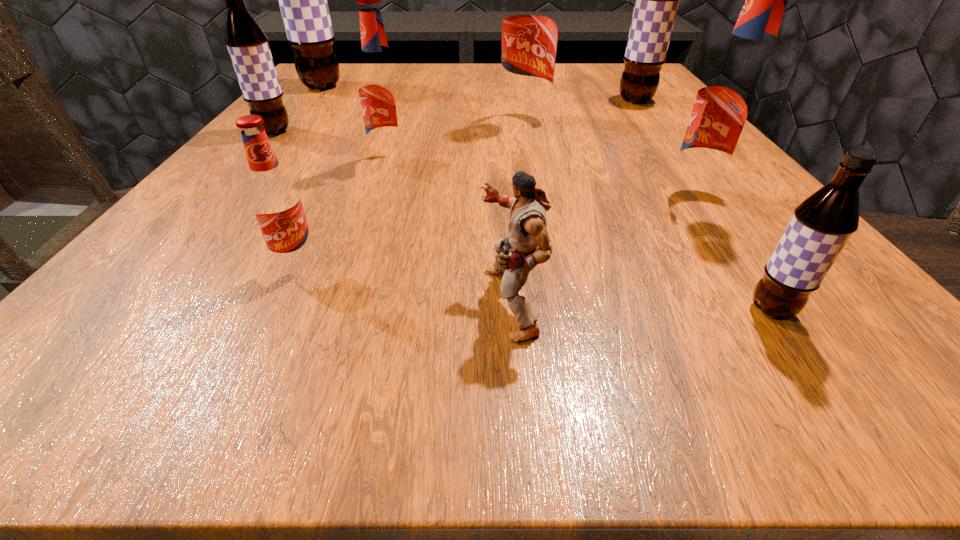
Identify the location of free space located 0.080m on the right of the nearest red root beer. This screenshot has width=960, height=540. (384, 264).

The width and height of the screenshot is (960, 540). Find the location of `free space located 0.050m on the left of the nearest root beer`. free space located 0.050m on the left of the nearest root beer is located at coordinates (702, 310).

The image size is (960, 540). I want to click on vacant space located 0.130m on the front-facing side of the puncher, so click(x=361, y=302).

At what (x,y) coordinates should I click in order to perform the action: click on free space located 0.250m on the front-facing side of the puncher. Please return your answer as a coordinate pair (x, y). The width and height of the screenshot is (960, 540). Looking at the image, I should click on (252, 302).

Locate an element on the screen. The width and height of the screenshot is (960, 540). vacant space located 0.310m on the front-facing side of the puncher is located at coordinates (198, 302).

Where is `root beer located in the near edge section of the desktop`? The width and height of the screenshot is (960, 540). root beer located in the near edge section of the desktop is located at coordinates (822, 224).

Find the location of a particular element. The height and width of the screenshot is (540, 960). puncher positioned at the near edge is located at coordinates (527, 245).

In order to click on object that is at the far left corner in this screenshot , I will do `click(303, 3)`.

Identify the location of object that is at the far right corner. The image size is (960, 540). (656, 0).

Locate an element on the screen. object at the near right corner is located at coordinates (822, 224).